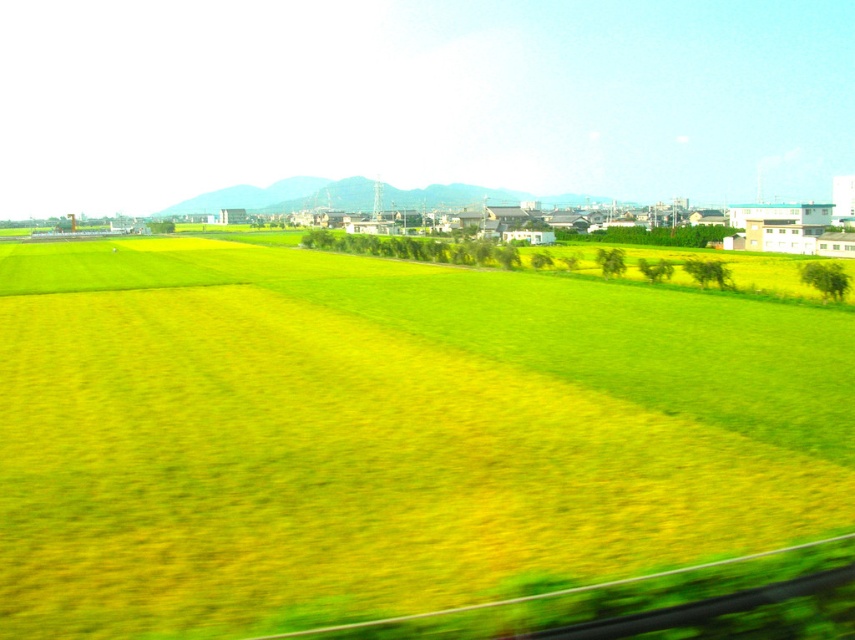
You are a hiker standing on the green grassy hill at center and want to reach the green grassy field at center. Which direction should you move to get there?

The green grassy field at center is located below the green grassy hill at center, so you should move downward to reach it.

You are standing in a rural landscape and see both the green grassy field at center and the green grassy hill at center. Which one takes up more space in the image?

The green grassy hill at center takes up more space in the image because it is larger than the green grassy field at center.